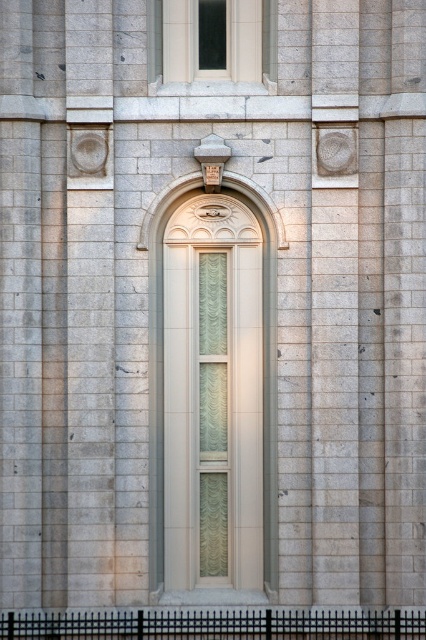
Measure the distance between matte cream glass door at center and matte glass window at upper center.

matte cream glass door at center and matte glass window at upper center are 10.19 feet apart.

Is point (149, 586) positioned before point (152, 17)?

That is True.

Does point (212, 337) come behind point (230, 22)?

No, (212, 337) is in front of (230, 22).

Identify the location of matte cream glass door at center. The width and height of the screenshot is (426, 640). (215, 388).